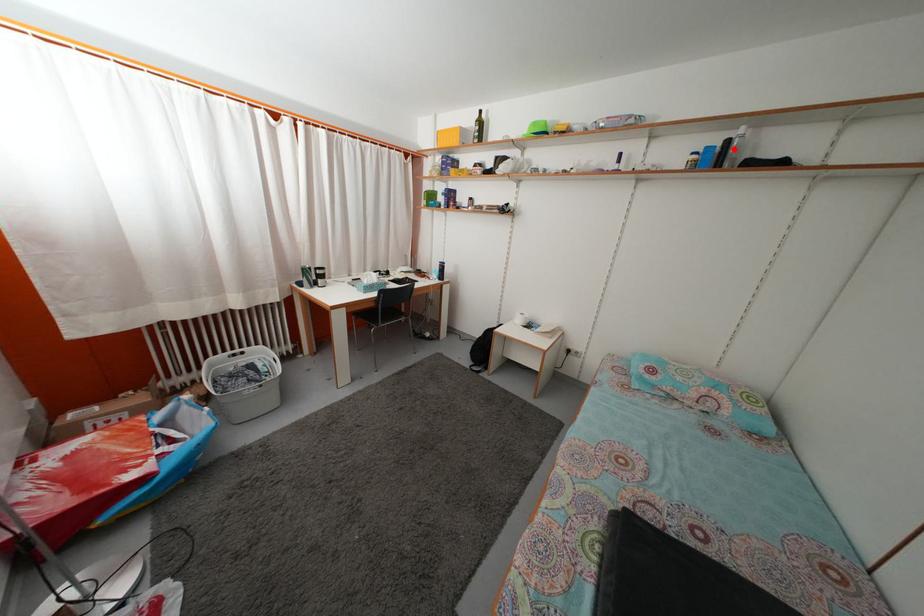
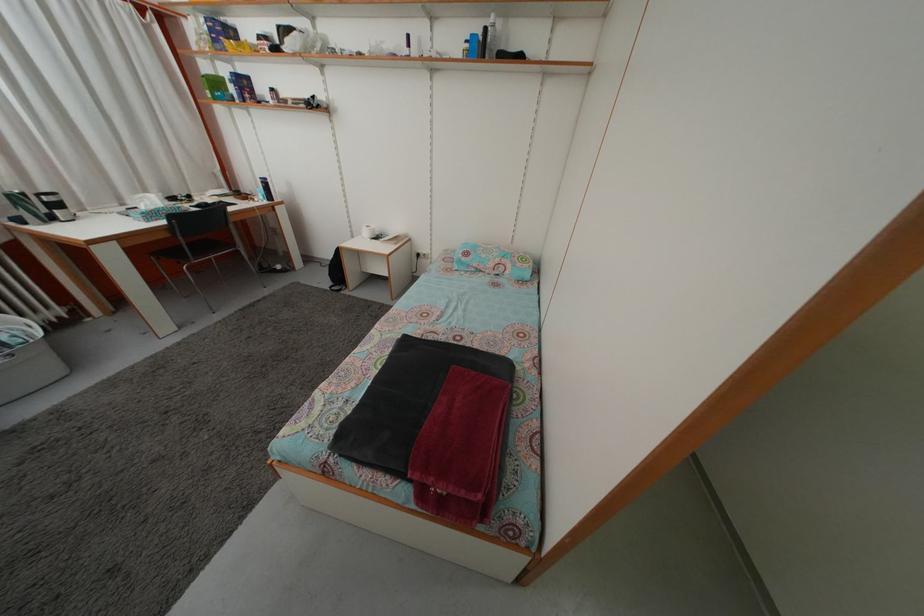
Question: I am providing you with two images of the same scene from different viewpoints. A red point is marked on the first image. Can you still see the location of the red point in image 2?

Choices:
 (A) Yes
 (B) No

Answer: (A)